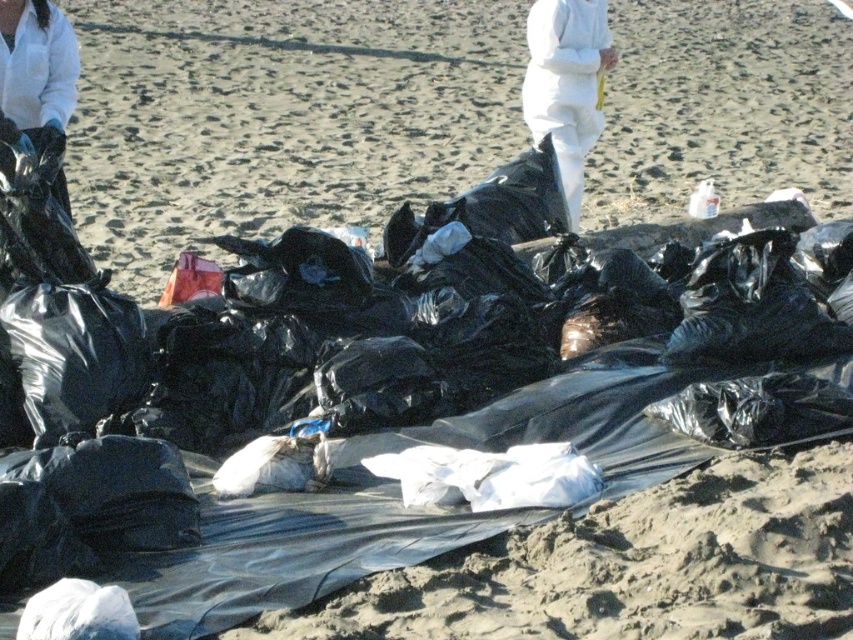
You are a photographer taking a picture of the beach cleanup scene. You notice the white fuzzy pants at center and the matte black gloves at upper left. Which object in the scene is taller?

The white fuzzy pants at center is taller than the matte black gloves at upper left.

You are a drone operator trying to locate a specific item on the beach. The item you are searching for is the white fuzzy pants at center. According to the coordinates provided, where exactly would you direct the drone to look?

The white fuzzy pants at center are located at coordinates point (566, 84).

Consider the image. You are a volunteer at the beach cleanup. You see the white fuzzy pants at center and the matte black gloves at upper left. Which object is covering the other?

The white fuzzy pants at center is positioned over matte black gloves at upper left, so the white fuzzy pants at center is covering the matte black gloves at upper left.